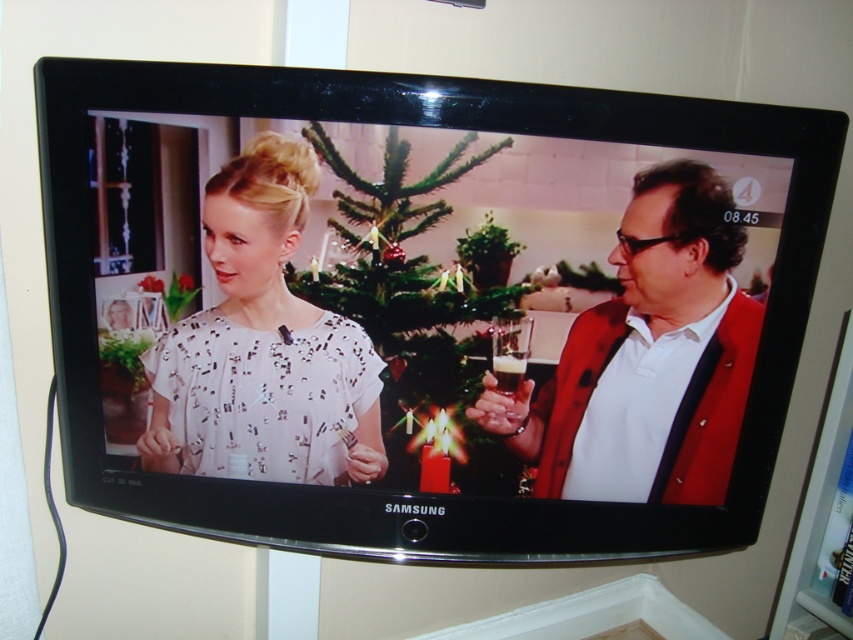
How much distance is there between green matte christmas tree at center and translucent glass wine glass at right?

green matte christmas tree at center and translucent glass wine glass at right are 3.42 inches apart.

Does green matte christmas tree at center have a larger size compared to translucent glass wine glass at right?

Correct, green matte christmas tree at center is larger in size than translucent glass wine glass at right.

Locate an element on the screen. The height and width of the screenshot is (640, 853). green matte christmas tree at center is located at coordinates (410, 276).

Where is `green matte christmas tree at center`? The image size is (853, 640). green matte christmas tree at center is located at coordinates (410, 276).

Is matte red blazer at right thinner than green matte christmas tree at center?

No.

Does matte red blazer at right appear under green matte christmas tree at center?

Yes.

This screenshot has width=853, height=640. I want to click on matte red blazer at right, so click(647, 358).

Looking at this image, which of these two, matte red blazer at right or translucent glass wine glass at right, stands taller?

With more height is matte red blazer at right.

Image resolution: width=853 pixels, height=640 pixels. I want to click on matte red blazer at right, so click(x=647, y=358).

Between point (728, 259) and point (506, 381), which one is positioned behind?

The point (506, 381) is more distant.

The width and height of the screenshot is (853, 640). I want to click on matte red blazer at right, so click(647, 358).